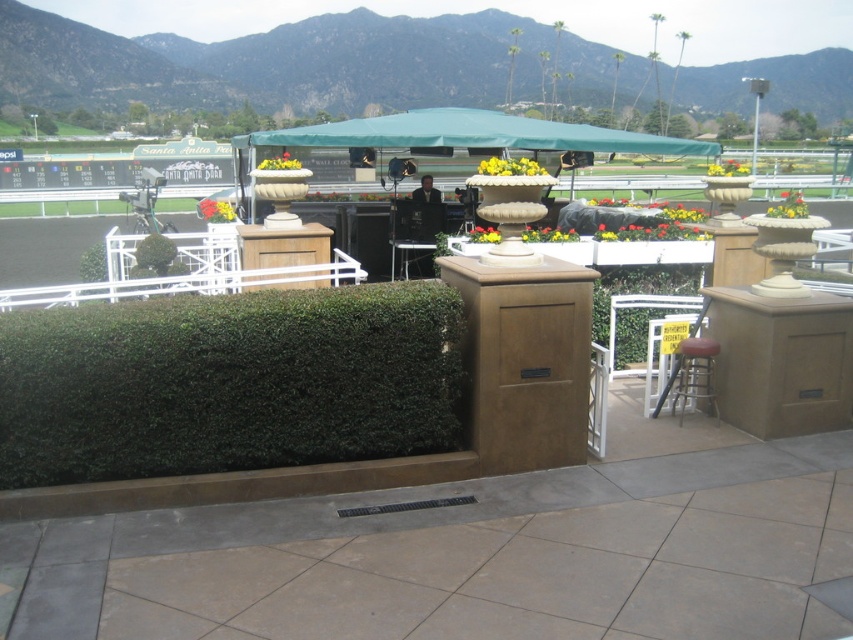
Question: Does metallic silver chair at center lie behind metallic silver stool at lower right?

Choices:
 (A) no
 (B) yes

Answer: (B)

Question: Does green textured hedge at center have a smaller size compared to wooden at center?

Choices:
 (A) yes
 (B) no

Answer: (B)

Question: Observing the image, what is the correct spatial positioning of wooden at center in reference to metallic silver stool at lower right?

Choices:
 (A) below
 (B) above

Answer: (B)

Question: Which of the following is the farthest from the observer?

Choices:
 (A) green textured hedge at center
 (B) metallic silver chair at center

Answer: (B)

Question: Which point appears farthest from the camera in this image?

Choices:
 (A) (693, 392)
 (B) (428, 246)
 (C) (281, 285)

Answer: (B)

Question: Which point appears closest to the camera in this image?

Choices:
 (A) (671, 404)
 (B) (180, 365)
 (C) (292, 250)
 (D) (440, 227)

Answer: (B)